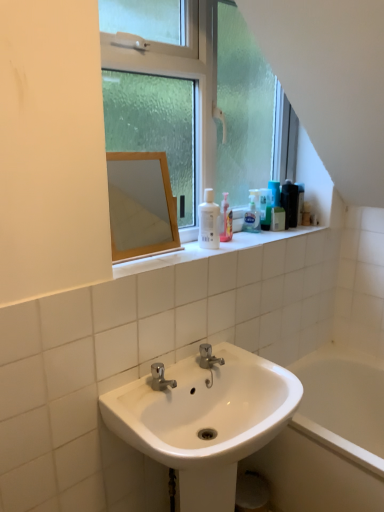
Locate an element on the screen. This screenshot has height=512, width=384. black glossy bottle at upper right, which is counted as the 2th mouthwash, starting from the right is located at coordinates (290, 203).

The height and width of the screenshot is (512, 384). What do you see at coordinates (195, 99) in the screenshot? I see `clear glass window at upper center` at bounding box center [195, 99].

This screenshot has height=512, width=384. Find the location of `white glossy sink at lower center`. white glossy sink at lower center is located at coordinates (205, 420).

What is the approximate height of green matte bottle at upper right, which appears as the 3th mouthwash when viewed from the front?

9.51 inches.

Looking at this image, measure the distance between green matte bottle at upper right, the 3th mouthwash when ordered from back to front, and camera.

6.19 feet.

Describe the element at coordinates (137, 204) in the screenshot. I see `wooden frame mirror at upper center` at that location.

Measure the distance between point (277, 445) and camera.

The distance of point (277, 445) from camera is 5.54 feet.

Looking at this image, measure the distance between point (300, 187) and camera.

The depth of point (300, 187) is 2.03 meters.

Locate an element on the screen. This screenshot has width=384, height=512. black glossy bottle at upper right, which is counted as the 2th mouthwash, starting from the right is located at coordinates (290, 203).

Choose the correct answer: Is green matte bottle at upper right, positioned as the second mouthwash in front-to-back order, inside green matte bottle at upper right, which appears as the 3th mouthwash when viewed from the front, or outside it?

green matte bottle at upper right, positioned as the second mouthwash in front-to-back order, is spatially situated outside green matte bottle at upper right, which appears as the 3th mouthwash when viewed from the front.

Considering the relative positions of green matte bottle at upper right, the 3th mouthwash when ordered from right to left, and green matte bottle at upper right, positioned as the fourth mouthwash in right-to-left order, in the image provided, is green matte bottle at upper right, the 3th mouthwash when ordered from right to left, to the left or to the right of green matte bottle at upper right, positioned as the fourth mouthwash in right-to-left order,?

Based on their positions, green matte bottle at upper right, the 3th mouthwash when ordered from right to left, is located to the right of green matte bottle at upper right, positioned as the fourth mouthwash in right-to-left order.

The height and width of the screenshot is (512, 384). What are the coordinates of `mouthwash that is the 3rd one below the green matte bottle at upper right, the 3th mouthwash when ordered from back to front (from a real-world perspective)` in the screenshot? It's located at (278, 219).

Is white glossy bottle at upper center, arranged as the fifth mouthwash when viewed from the back, oriented away from white glossy sink at lower center?

No.

Would you say white glossy bottle at upper center, positioned as the fifth mouthwash in right-to-left order, contains white glossy sink at lower center?

No, white glossy sink at lower center is not a part of white glossy bottle at upper center, positioned as the fifth mouthwash in right-to-left order.

Which is more to the left, white glossy bottle at upper center, positioned as the fifth mouthwash in right-to-left order, or white glossy sink at lower center?

Positioned to the left is white glossy bottle at upper center, positioned as the fifth mouthwash in right-to-left order.

Considering the points (212, 248) and (248, 405), which point is in front, point (212, 248) or point (248, 405)?

The point (248, 405) is closer to the camera.

From a real-world perspective, which object stands above the other?

white glossy bottle at upper center, positioned as the fifth mouthwash in right-to-left order.

Can you confirm if white glossy sink at lower center is positioned to the right of white glossy bottle at upper center, the 1th mouthwash when ordered from left to right?

Indeed, white glossy sink at lower center is positioned on the right side of white glossy bottle at upper center, the 1th mouthwash when ordered from left to right.

Which object is further away from the camera taking this photo, white glossy sink at lower center or white glossy bottle at upper center, arranged as the fifth mouthwash when viewed from the back?

Positioned behind is white glossy bottle at upper center, arranged as the fifth mouthwash when viewed from the back.

Considering the relative sizes of white glossy sink at lower center and white glossy bottle at upper center, the 1th mouthwash from the front, in the image provided, is white glossy sink at lower center bigger than white glossy bottle at upper center, the 1th mouthwash from the front,?

Correct, white glossy sink at lower center is larger in size than white glossy bottle at upper center, the 1th mouthwash from the front.

Does green matte bottle at upper right, the 3th mouthwash when ordered from back to front, have a larger size compared to white glossy sink at lower center?

Actually, green matte bottle at upper right, the 3th mouthwash when ordered from back to front, might be smaller than white glossy sink at lower center.

Considering the relative positions of green matte bottle at upper right, positioned as the fourth mouthwash in right-to-left order, and white glossy sink at lower center in the image provided, is green matte bottle at upper right, positioned as the fourth mouthwash in right-to-left order, to the right of white glossy sink at lower center from the viewer's perspective?

Correct, you'll find green matte bottle at upper right, positioned as the fourth mouthwash in right-to-left order, to the right of white glossy sink at lower center.

Is green matte bottle at upper right, positioned as the fourth mouthwash in right-to-left order, in contact with white glossy sink at lower center?

They are not placed beside each other.

Is green matte bottle at upper right, which is counted as the second mouthwash, starting from the left, positioned with its back to white glossy sink at lower center?

No, green matte bottle at upper right, which is counted as the second mouthwash, starting from the left,'s orientation is not away from white glossy sink at lower center.

Is point (199, 208) behind point (303, 187)?

No, (199, 208) is in front of (303, 187).

Considering the sizes of white glossy bottle at upper center, positioned as the fifth mouthwash in right-to-left order, and black plastic mouthwash at upper right, which is the 1th mouthwash from right to left, in the image, is white glossy bottle at upper center, positioned as the fifth mouthwash in right-to-left order, wider or thinner than black plastic mouthwash at upper right, which is the 1th mouthwash from right to left,?

Considering their sizes, white glossy bottle at upper center, positioned as the fifth mouthwash in right-to-left order, looks broader than black plastic mouthwash at upper right, which is the 1th mouthwash from right to left.

From a real-world perspective, is white glossy bottle at upper center, the 1th mouthwash from the front, positioned above or below black plastic mouthwash at upper right, which is the fifth mouthwash in front-to-back order?

Clearly, from a real-world perspective, white glossy bottle at upper center, the 1th mouthwash from the front, is above black plastic mouthwash at upper right, which is the fifth mouthwash in front-to-back order.

How different are the orientations of white glossy bottle at upper center, the 1th mouthwash when ordered from left to right, and black plastic mouthwash at upper right, the 5th mouthwash viewed from the left, in degrees?

They differ by 0.00443 degrees in their facing directions.

Based on their positions, is translucent plastic soap dispenser at upper center located to the left or right of green matte bottle at upper right, which appears as the 3th mouthwash when viewed from the front?

Based on their positions, translucent plastic soap dispenser at upper center is located to the left of green matte bottle at upper right, which appears as the 3th mouthwash when viewed from the front.

Does point (254, 204) come closer to viewer compared to point (270, 215)?

Yes, point (254, 204) is in front of point (270, 215).

Would you say translucent plastic soap dispenser at upper center is a long distance from green matte bottle at upper right, positioned as the fourth mouthwash in right-to-left order?

They are positioned close to each other.

In terms of size, does translucent plastic soap dispenser at upper center appear bigger or smaller than green matte bottle at upper right, positioned as the fourth mouthwash in right-to-left order?

Clearly, translucent plastic soap dispenser at upper center is larger in size than green matte bottle at upper right, positioned as the fourth mouthwash in right-to-left order.

Between green matte bottle at upper right, the 3th mouthwash in the left-to-right sequence, and white glossy bottle at upper center, the 1th mouthwash from the front, which one is positioned in front?

white glossy bottle at upper center, the 1th mouthwash from the front, is more forward.

From a real-world perspective, is green matte bottle at upper right, the 3th mouthwash in the left-to-right sequence, below white glossy bottle at upper center, positioned as the fifth mouthwash in right-to-left order?

Yes, from a real-world perspective, green matte bottle at upper right, the 3th mouthwash in the left-to-right sequence, is below white glossy bottle at upper center, positioned as the fifth mouthwash in right-to-left order.

Considering the positions of points (272, 222) and (212, 227), is point (272, 222) farther from camera compared to point (212, 227)?

Yes.

The height and width of the screenshot is (512, 384). In order to click on the 1st mouthwash behind the green matte bottle at upper right, the 3th mouthwash when ordered from right to left, counting from the anchor's position in this screenshot , I will do `click(265, 208)`.

Find the location of a particular element. the 1st mouthwash above when counting from the white glossy sink at lower center (from the image's perspective) is located at coordinates (209, 221).

Considering their positions, is translucent plastic soap dispenser at upper center positioned closer to white glossy sink at lower center than black glossy bottle at upper right, the 4th mouthwash when ordered from front to back?

Among the two, translucent plastic soap dispenser at upper center is located nearer to white glossy sink at lower center.

Estimate the real-world distances between objects in this image. Which object is closer to clear glass window at upper center, black glossy bottle at upper right, which is counted as the 2th mouthwash, starting from the back, or white glossy sink at lower center?

black glossy bottle at upper right, which is counted as the 2th mouthwash, starting from the back, is closer to clear glass window at upper center.

From the image, which object appears to be farther from clear glass window at upper center, black plastic mouthwash at upper right, which is the 1th mouthwash from right to left, or wooden frame mirror at upper center?

black plastic mouthwash at upper right, which is the 1th mouthwash from right to left, lies further to clear glass window at upper center than the other object.

From the image, which object appears to be farther from black plastic mouthwash at upper right, the 5th mouthwash viewed from the left, green matte bottle at upper right, the 3th mouthwash in the left-to-right sequence, or translucent plastic soap dispenser at upper center?

translucent plastic soap dispenser at upper center.

In the scene shown: When comparing their distances from green matte bottle at upper right, which is counted as the 4th mouthwash, starting from the back, does white glossy bathtub at lower right or translucent plastic soap dispenser at upper center seem further?

white glossy bathtub at lower right is positioned further to the anchor green matte bottle at upper right, which is counted as the 4th mouthwash, starting from the back.

Considering their positions, is green matte bottle at upper right, the 3th mouthwash when ordered from right to left, positioned closer to translucent plastic soap dispenser at upper center than clear glass window at upper center?

green matte bottle at upper right, the 3th mouthwash when ordered from right to left, lies closer to translucent plastic soap dispenser at upper center than the other object.

Estimate the real-world distances between objects in this image. Which object is further from translucent plastic soap dispenser at upper center, black plastic mouthwash at upper right, which is the 1th mouthwash from right to left, or green matte bottle at upper right, which appears as the 3th mouthwash when viewed from the front?

black plastic mouthwash at upper right, which is the 1th mouthwash from right to left, is further to translucent plastic soap dispenser at upper center.

When comparing their distances from wooden frame mirror at upper center, does white glossy bottle at upper center, positioned as the fifth mouthwash in right-to-left order, or black glossy bottle at upper right, the 4th mouthwash when ordered from front to back, seem closer?

white glossy bottle at upper center, positioned as the fifth mouthwash in right-to-left order, is positioned closer to the anchor wooden frame mirror at upper center.

Find the location of a particular element. The height and width of the screenshot is (512, 384). mirror located between clear glass window at upper center and black plastic mouthwash at upper right, which is the 1th mouthwash from right to left, in the depth direction is located at coordinates (137, 204).

The height and width of the screenshot is (512, 384). Find the location of `soap dispenser between wooden frame mirror at upper center and black glossy bottle at upper right, the 4th mouthwash when ordered from front to back, in the front-back direction`. soap dispenser between wooden frame mirror at upper center and black glossy bottle at upper right, the 4th mouthwash when ordered from front to back, in the front-back direction is located at coordinates (252, 214).

The image size is (384, 512). In order to click on soap dispenser between clear glass window at upper center and white glossy bathtub at lower right in the vertical direction in this screenshot , I will do `click(252, 214)`.

I want to click on mirror between black plastic mouthwash at upper right, the 5th mouthwash viewed from the left, and white glossy bathtub at lower right, in the vertical direction, so click(x=137, y=204).